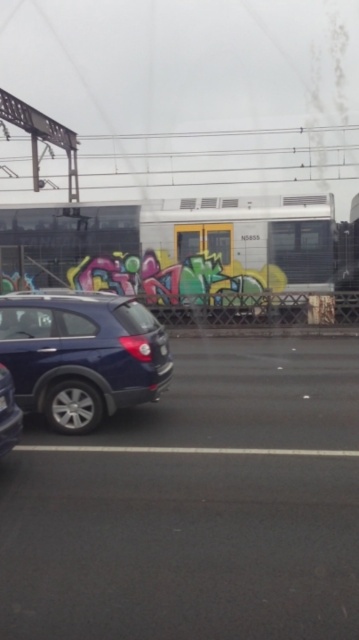
Is satin blue suv at left bigger than satin black car at left?

Yes, satin blue suv at left is bigger than satin black car at left.

Which is more to the right, satin blue suv at left or satin black car at left?

From the viewer's perspective, satin blue suv at left appears more on the right side.

Where is `satin blue suv at left`? This screenshot has width=359, height=640. satin blue suv at left is located at coordinates (81, 355).

Can you confirm if satin black car at left is bigger than black plastic license plate at lower left?

Correct, satin black car at left is larger in size than black plastic license plate at lower left.

Is satin black car at left smaller than black plastic license plate at lower left?

Actually, satin black car at left might be larger than black plastic license plate at lower left.

Which is behind, point (14, 435) or point (0, 406)?

Point (14, 435)

Locate an element on the screen. The width and height of the screenshot is (359, 640). satin black car at left is located at coordinates (8, 413).

Looking at this image, can you confirm if satin blue suv at left is positioned to the left of black plastic license plate at lower left?

No, satin blue suv at left is not to the left of black plastic license plate at lower left.

Is the position of satin blue suv at left more distant than that of black plastic license plate at lower left?

Yes.

Is point (90, 429) farther from camera compared to point (0, 410)?

Yes, it is behind point (0, 410).

You are a GUI agent. You are given a task and a screenshot of the screen. Output one action in this format:
    pyautogui.click(x=<x>, y=<y>)
    Task: Click on the satin blue suv at left
    
    Given the screenshot: What is the action you would take?
    pyautogui.click(x=81, y=355)